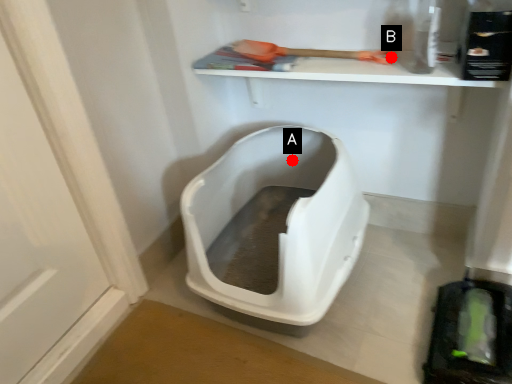
Question: Two points are circled on the image, labeled by A and B beside each circle. Which point is further to the camera?

Choices:
 (A) A is further
 (B) B is further

Answer: (A)